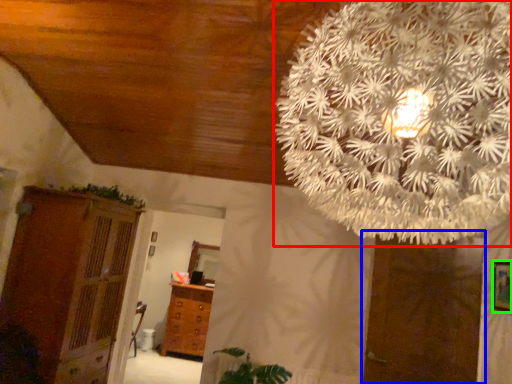
Question: Which object is the closest to the flower (highlighted by a red box)? Choose among these: door (highlighted by a blue box) or picture frame (highlighted by a green box).

Choices:
 (A) door
 (B) picture frame

Answer: (B)